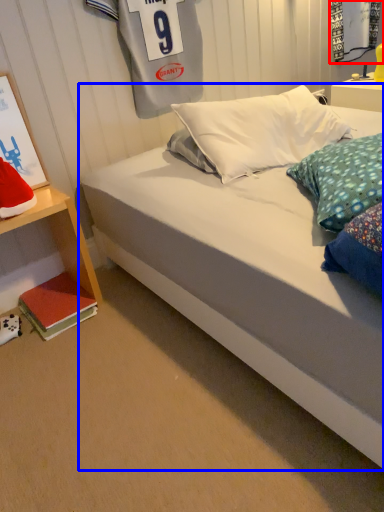
Question: Which object appears farthest to the camera in this image, shop window (highlighted by a red box) or bed (highlighted by a blue box)?

Choices:
 (A) shop window
 (B) bed

Answer: (A)